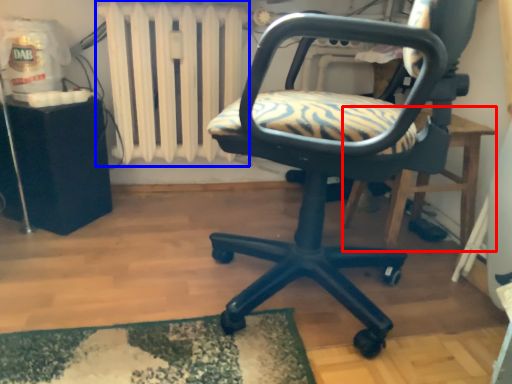
Question: Among these objects, which one is nearest to the camera, table (highlighted by a red box) or radiator (highlighted by a blue box)?

Choices:
 (A) table
 (B) radiator

Answer: (A)